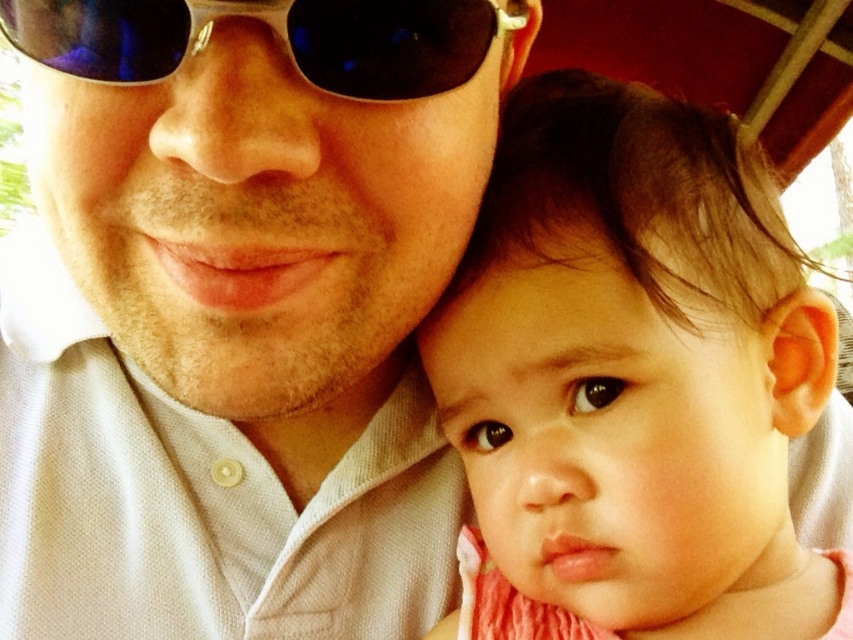
Which is below, smooth pink fabric at center or sunglasses at upper center?

smooth pink fabric at center is lower down.

Can you confirm if smooth pink fabric at center is taller than sunglasses at upper center?

Yes, smooth pink fabric at center is taller than sunglasses at upper center.

At what (x,y) coordinates should I click in order to perform the action: click on smooth pink fabric at center. Please return your answer as a coordinate pair (x, y). Looking at the image, I should click on (631, 380).

Can you confirm if matte white shirt at center is wider than sunglasses at upper center?

Yes.

Between point (9, 20) and point (473, 20), which one is positioned behind?

Positioned behind is point (473, 20).

Who is more forward, (292,545) or (113,49)?

Point (113,49) is in front.

Find the location of a particular element. The width and height of the screenshot is (853, 640). matte white shirt at center is located at coordinates (236, 310).

Which is in front, point (51, 29) or point (669, 152)?

Point (51, 29) is more forward.

At what (x,y) coordinates should I click in order to perform the action: click on matte white shirt at center. Please return your answer as a coordinate pair (x, y). This screenshot has width=853, height=640. Looking at the image, I should click on (236, 310).